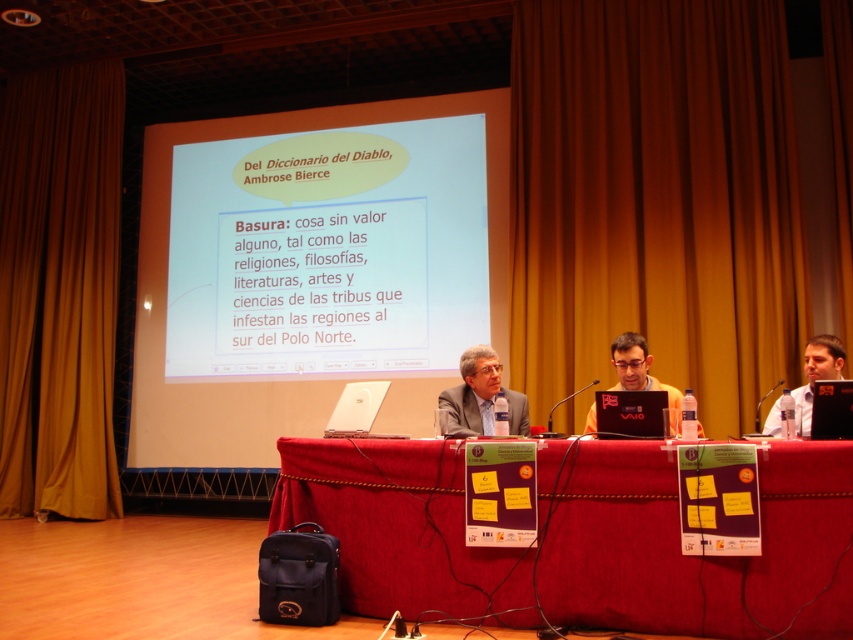
You are a stagehand preparing to adjust the height of the red fabric table at lower center and the matte plastic screen at center. The screen needs to be lowered to ensure it is at eye level for the presenter. Considering their current heights, which object should you adjust first?

The red fabric table at lower center is much taller than the matte plastic screen at center. To lower the screen to eye level, you should first adjust the matte plastic screen at center since it is currently shorter and needs to be lowered further.

You are an event organizer setting up for a presentation. You need to place a 3.5 meter long banner between the white glossy projector screen at upper center and the matte plastic screen at center. Will the banner fit between them?

The white glossy projector screen at upper center and matte plastic screen at center are 3.82 meters apart, so the 3.5 meter long banner will fit between them since it is shorter than the distance between the two screens.